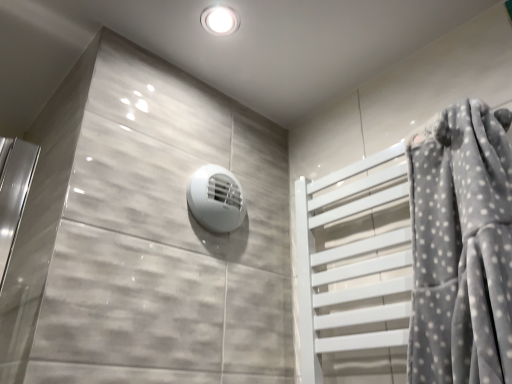
Find the location of a particular element. white glossy light fixture at upper center is located at coordinates (219, 20).

Describe the element at coordinates (219, 20) in the screenshot. I see `white glossy light fixture at upper center` at that location.

At what (x,y) coordinates should I click in order to perform the action: click on white glossy light fixture at upper center. Please return your answer as a coordinate pair (x, y). Looking at the image, I should click on pyautogui.click(x=219, y=20).